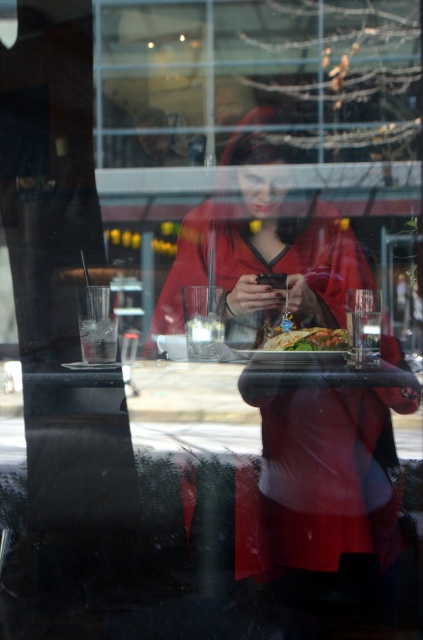
Question: Which point is closer to the camera taking this photo?

Choices:
 (A) (283, 339)
 (B) (230, 214)
 (C) (312, 100)

Answer: (A)

Question: Estimate the real-world distances between objects in this image. Which object is closer to the green leafy salad at center?

Choices:
 (A) matte red coat at center
 (B) transparent glass window at upper center

Answer: (A)

Question: Does transparent glass window at upper center have a greater width compared to matte red coat at center?

Choices:
 (A) yes
 (B) no

Answer: (A)

Question: Which point is farther to the camera?

Choices:
 (A) (186, 67)
 (B) (219, 227)

Answer: (B)

Question: Is transparent glass window at upper center thinner than matte red coat at center?

Choices:
 (A) yes
 (B) no

Answer: (B)

Question: Is transparent glass window at upper center thinner than matte red coat at center?

Choices:
 (A) no
 (B) yes

Answer: (A)